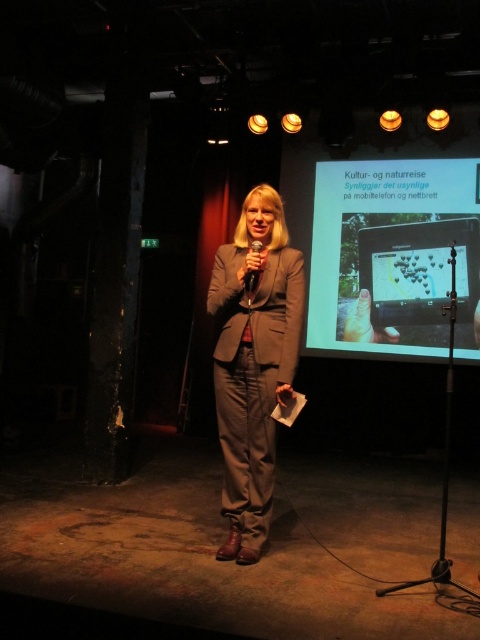
Question: Is matte plastic projector screen at upper right below matte gray suit at center?

Choices:
 (A) yes
 (B) no

Answer: (B)

Question: Considering the relative positions of matte plastic projector screen at upper right and matte gray suit at center in the image provided, where is matte plastic projector screen at upper right located with respect to matte gray suit at center?

Choices:
 (A) right
 (B) left

Answer: (A)

Question: Which point is farther to the camera?

Choices:
 (A) black plastic microphone at center
 (B) matte gray suit at center

Answer: (A)

Question: Which of these objects is positioned closest to the matte gray suit at center?

Choices:
 (A) matte plastic projector screen at upper right
 (B) black plastic microphone at center

Answer: (B)

Question: Is matte plastic projector screen at upper right below matte gray suit at center?

Choices:
 (A) no
 (B) yes

Answer: (A)

Question: Which point is closer to the camera?

Choices:
 (A) (254, 413)
 (B) (470, 355)

Answer: (A)